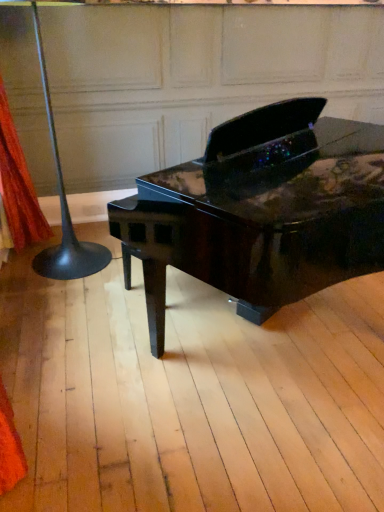
Question: From a real-world perspective, is black glossy floor lamp at left positioned under orange fabric at left based on gravity?

Choices:
 (A) yes
 (B) no

Answer: (A)

Question: Is black glossy floor lamp at left next to orange fabric at left and touching it?

Choices:
 (A) no
 (B) yes

Answer: (A)

Question: Considering the relative sizes of black glossy floor lamp at left and orange fabric at left in the image provided, is black glossy floor lamp at left smaller than orange fabric at left?

Choices:
 (A) yes
 (B) no

Answer: (B)

Question: Is black glossy floor lamp at left at the right side of orange fabric at left?

Choices:
 (A) no
 (B) yes

Answer: (B)

Question: Is black glossy floor lamp at left facing away from orange fabric at left?

Choices:
 (A) yes
 (B) no

Answer: (B)

Question: Is the position of black glossy floor lamp at left more distant than that of orange fabric at left?

Choices:
 (A) yes
 (B) no

Answer: (B)

Question: Considering the relative positions of black glossy floor lamp at left and glossy black piano at center in the image provided, is black glossy floor lamp at left in front of glossy black piano at center?

Choices:
 (A) yes
 (B) no

Answer: (B)

Question: Can you confirm if black glossy floor lamp at left is thinner than glossy black piano at center?

Choices:
 (A) yes
 (B) no

Answer: (A)

Question: Is glossy black piano at center at the back of black glossy floor lamp at left?

Choices:
 (A) yes
 (B) no

Answer: (B)

Question: Considering the relative sizes of black glossy floor lamp at left and glossy black piano at center in the image provided, is black glossy floor lamp at left bigger than glossy black piano at center?

Choices:
 (A) no
 (B) yes

Answer: (A)

Question: Would you say black glossy floor lamp at left contains glossy black piano at center?

Choices:
 (A) yes
 (B) no

Answer: (B)

Question: Can you see black glossy floor lamp at left touching glossy black piano at center?

Choices:
 (A) yes
 (B) no

Answer: (B)

Question: Does glossy black piano at center appear on the left side of orange fabric at left?

Choices:
 (A) yes
 (B) no

Answer: (B)